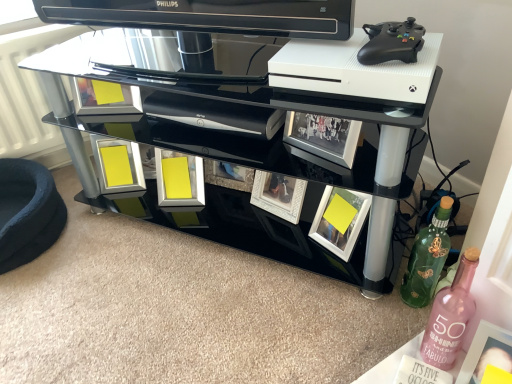
Where is `vacant space to the left of pink glass bottle at lower right, the 1th bottle when ordered from front to back`? Image resolution: width=512 pixels, height=384 pixels. vacant space to the left of pink glass bottle at lower right, the 1th bottle when ordered from front to back is located at coordinates coord(356,342).